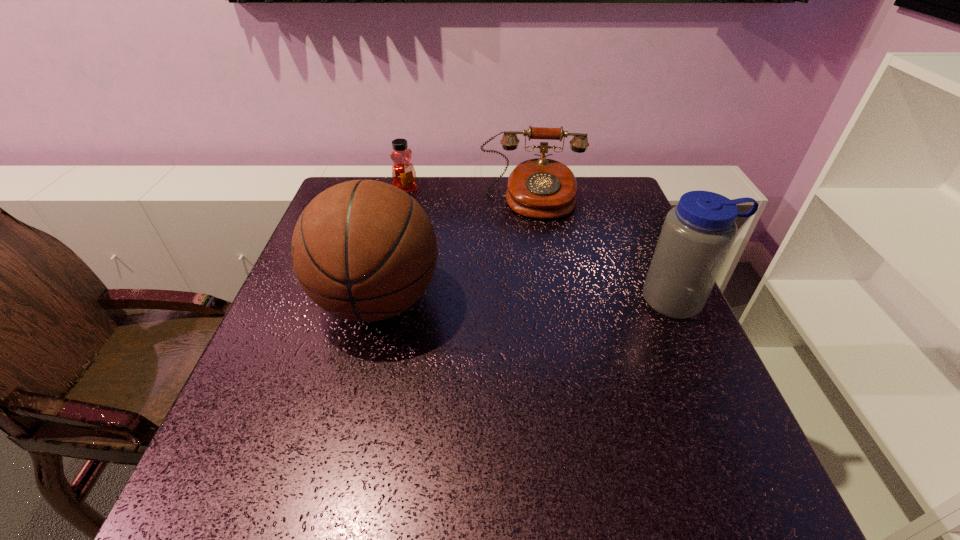
Find the location of a particular element. free space located on the dial of the telephone is located at coordinates (533, 245).

Locate an element on the screen. This screenshot has height=540, width=960. vacant space located 0.220m on the dial of the telephone is located at coordinates (535, 272).

At what (x,y) coordinates should I click in order to perform the action: click on honey that is at the far edge. Please return your answer as a coordinate pair (x, y). Looking at the image, I should click on (403, 173).

The height and width of the screenshot is (540, 960). What are the coordinates of `telephone that is positioned at the far edge` in the screenshot? It's located at (541, 188).

You are a GUI agent. You are given a task and a screenshot of the screen. Output one action in this format:
    pyautogui.click(x=<x>, y=<y>)
    Task: Click on the object that is at the left edge
    
    Given the screenshot: What is the action you would take?
    pyautogui.click(x=364, y=250)

You are a GUI agent. You are given a task and a screenshot of the screen. Output one action in this format:
    pyautogui.click(x=<x>, y=<y>)
    Task: Click on the water bottle that is at the right edge
    This screenshot has width=960, height=540.
    Given the screenshot: What is the action you would take?
    pyautogui.click(x=697, y=235)

This screenshot has height=540, width=960. I want to click on telephone situated at the right edge, so click(541, 188).

You are a GUI agent. You are given a task and a screenshot of the screen. Output one action in this format:
    pyautogui.click(x=<x>, y=<y>)
    Task: Click on the object at the far right corner
    The width and height of the screenshot is (960, 540).
    Given the screenshot: What is the action you would take?
    pyautogui.click(x=541, y=188)

Find the location of `free space at the far edge of the desktop`. free space at the far edge of the desktop is located at coordinates (429, 210).

What are the coordinates of `vacant region at the near edge of the desktop` in the screenshot? It's located at (422, 442).